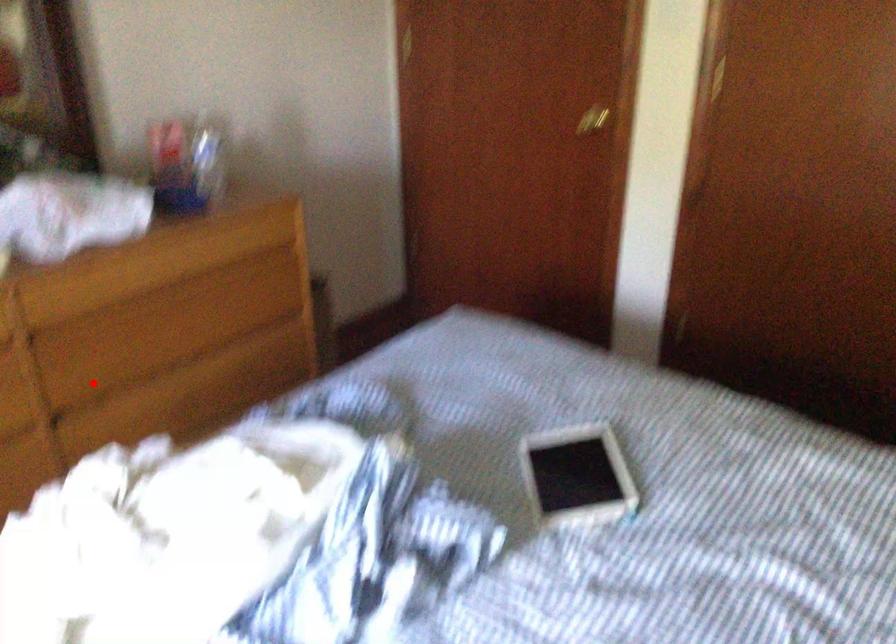
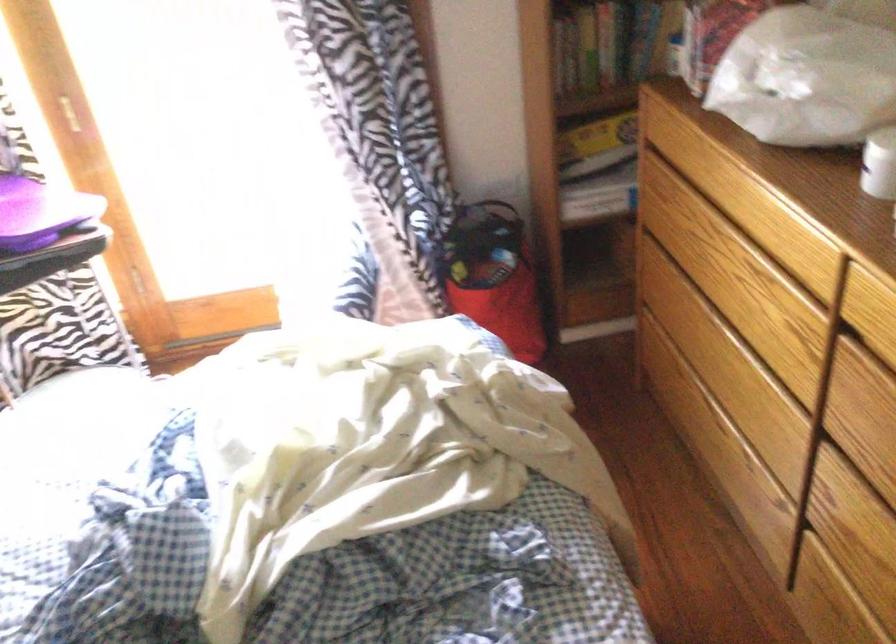
Where in the second image is the point corresponding to the highlighted location from the first image?

(868, 460)